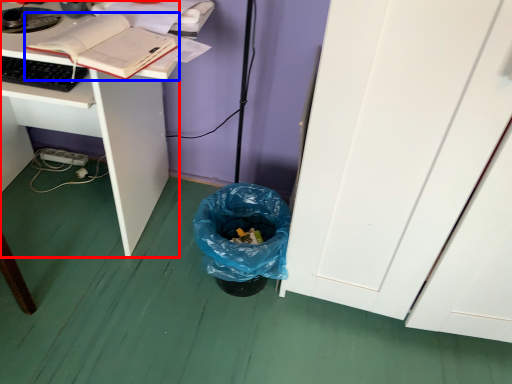
Question: Which object is further to the camera taking this photo, desk (highlighted by a red box) or book (highlighted by a blue box)?

Choices:
 (A) desk
 (B) book

Answer: (A)